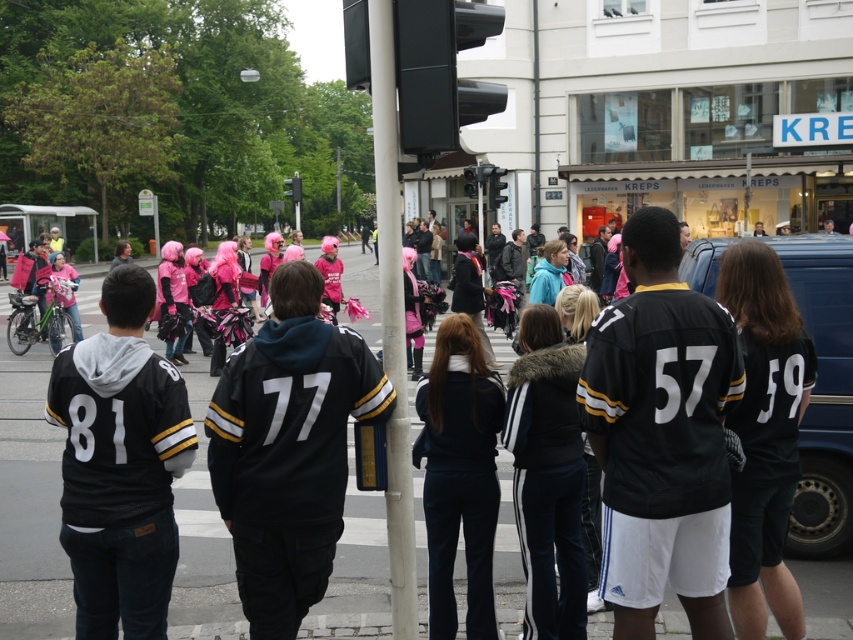
You are a photographer trying to capture a clear shot of both the black jersey at center and the matte pink helmet at left. Since you want both subjects to appear equally prominent in the photo, which object should you zoom in on and why?

The black jersey at center is smaller in size compared to the matte pink helmet at left. To make both appear equally prominent, you should zoom in on the black jersey at center to enlarge its size in the frame while keeping the matte pink helmet at left within the shot.

You are a pedestrian trying to cross the street and see the white plastic pole at center and the matte pink helmet at left. Which object is nearer to you?

The white plastic pole at center is closer to the viewer than the matte pink helmet at left.

Based on the photo, you are a photographer trying to capture a photo of the black jersey at center and the matte pink helmet at left. Based on their positions, which object should you focus on first if you want to ensure both are in the frame without moving the camera?

The black jersey at center is positioned under the matte pink helmet at left, so you should focus on the matte pink helmet at left first to ensure both are in the frame without moving the camera.